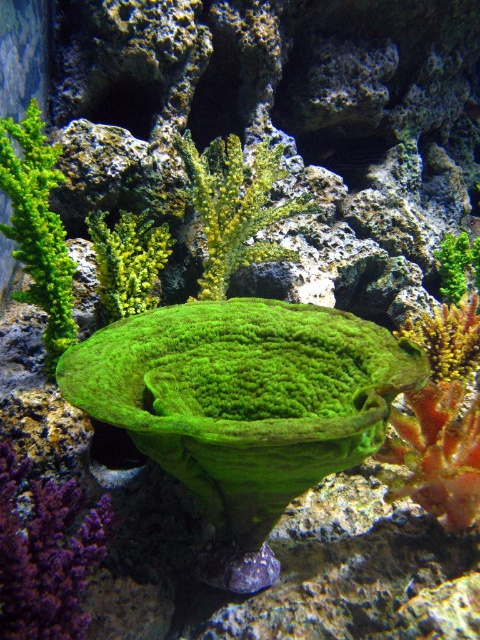
You are a scuba diver swimming in this underwater scene. You see the green mossy rock at lower left and the green fuzzy coral at center. Which object is positioned lower in the water?

The green mossy rock at lower left is positioned below the green fuzzy coral at center, so it is lower in the water.